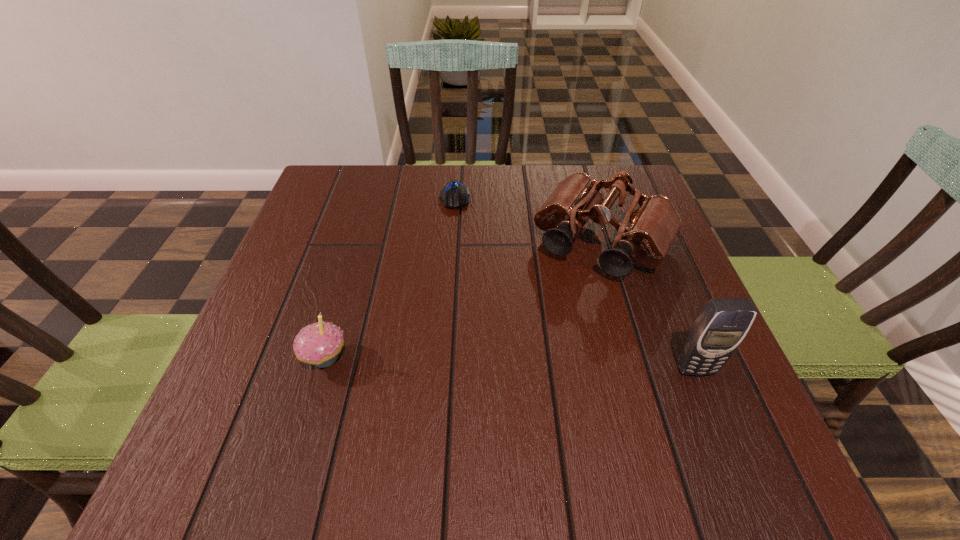
The width and height of the screenshot is (960, 540). Identify the location of cupcake. (319, 344).

The image size is (960, 540). I want to click on the leftmost object, so click(x=319, y=344).

At what (x,y) coordinates should I click in order to perform the action: click on cellular telephone. Please return your answer as a coordinate pair (x, y). Image resolution: width=960 pixels, height=540 pixels. Looking at the image, I should click on (723, 323).

Find the location of a particular element. Image resolution: width=960 pixels, height=540 pixels. the second tallest object is located at coordinates (650, 225).

This screenshot has height=540, width=960. What are the coordinates of `the third object from right to left` in the screenshot? It's located at (454, 195).

Locate an element on the screen. This screenshot has width=960, height=540. the shortest object is located at coordinates pos(454,195).

You are a GUI agent. You are given a task and a screenshot of the screen. Output one action in this format:
    pyautogui.click(x=<x>, y=<y>)
    Task: Click on the vacant point located on the back of the second shortest object
    
    Given the screenshot: What is the action you would take?
    pyautogui.click(x=365, y=221)

Find the location of `vacant space located on the front face of the tallest object`. vacant space located on the front face of the tallest object is located at coordinates (714, 415).

This screenshot has width=960, height=540. Identify the location of free space located 0.170m through the eyepieces of the second tallest object. (541, 338).

I want to click on blank space located through the eyepieces of the second tallest object, so click(x=557, y=314).